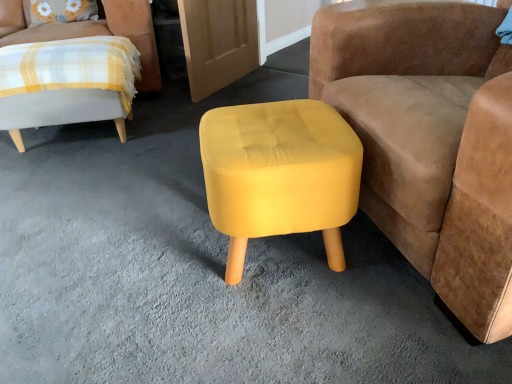
Question: Considering the relative sizes of yellow fabric stool at center and plaid fabric chair at left, which is the 1th chair from back to front, in the image provided, is yellow fabric stool at center thinner than plaid fabric chair at left, which is the 1th chair from back to front,?

Choices:
 (A) yes
 (B) no

Answer: (A)

Question: Does yellow fabric stool at center have a lesser height compared to plaid fabric chair at left, marked as the second chair in a right-to-left arrangement?

Choices:
 (A) yes
 (B) no

Answer: (A)

Question: Is yellow fabric stool at center positioned in front of plaid fabric chair at left, the 1th chair positioned from the left?

Choices:
 (A) yes
 (B) no

Answer: (A)

Question: Does yellow fabric stool at center have a greater height compared to plaid fabric chair at left, which ranks as the second chair in front-to-back order?

Choices:
 (A) no
 (B) yes

Answer: (A)

Question: Is yellow fabric stool at center positioned beyond the bounds of plaid fabric chair at left, which ranks as the second chair in front-to-back order?

Choices:
 (A) no
 (B) yes

Answer: (B)

Question: Looking at the image, does velvet mustard stool at center, the second chair in the back-to-front sequence, seem bigger or smaller compared to velvety floral pillow at upper left?

Choices:
 (A) small
 (B) big

Answer: (B)

Question: Choose the correct answer: Is velvet mustard stool at center, which is counted as the 1th chair, starting from the front, inside velvety floral pillow at upper left or outside it?

Choices:
 (A) outside
 (B) inside

Answer: (A)

Question: In terms of height, does velvet mustard stool at center, which is counted as the 1th chair, starting from the front, look taller or shorter compared to velvety floral pillow at upper left?

Choices:
 (A) tall
 (B) short

Answer: (A)

Question: In the image, is velvet mustard stool at center, which is counted as the 1th chair, starting from the front, positioned in front of or behind velvety floral pillow at upper left?

Choices:
 (A) behind
 (B) front

Answer: (B)

Question: From their relative heights in the image, would you say yellow fabric stool at center is taller or shorter than velvety floral pillow at upper left?

Choices:
 (A) tall
 (B) short

Answer: (A)

Question: Is yellow fabric stool at center bigger or smaller than velvety floral pillow at upper left?

Choices:
 (A) big
 (B) small

Answer: (A)

Question: From a real-world perspective, is yellow fabric stool at center physically located above or below velvety floral pillow at upper left?

Choices:
 (A) below
 (B) above

Answer: (A)

Question: Considering the positions of yellow fabric stool at center and velvety floral pillow at upper left in the image, is yellow fabric stool at center wider or thinner than velvety floral pillow at upper left?

Choices:
 (A) wide
 (B) thin

Answer: (A)

Question: Is velvet mustard stool at center, arranged as the 1th chair when viewed from the right, wider or thinner than plaid fabric chair at left, which is the 1th chair from back to front?

Choices:
 (A) wide
 (B) thin

Answer: (B)

Question: Relative to plaid fabric chair at left, which ranks as the second chair in front-to-back order, is velvet mustard stool at center, which is counted as the 1th chair, starting from the front, in front or behind?

Choices:
 (A) front
 (B) behind

Answer: (A)